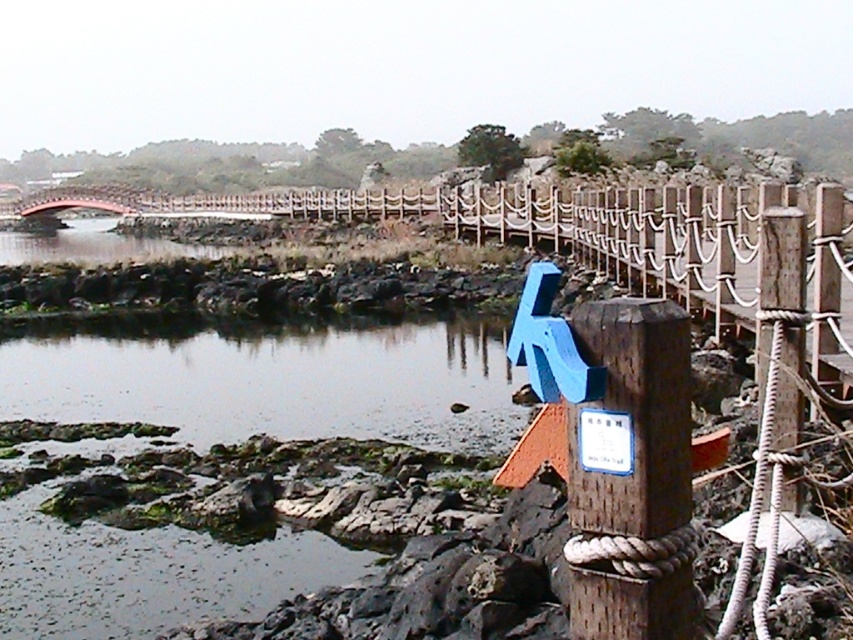
What do you see at coordinates (633, 474) in the screenshot?
I see `brown wooden post at center-right` at bounding box center [633, 474].

Does point (622, 477) come behind point (601, 472)?

No, it is not.

Who is more distant from viewer, (618, 605) or (602, 432)?

The point (618, 605) is behind.

This screenshot has width=853, height=640. In order to click on brown wooden post at center-right in this screenshot , I will do `click(633, 474)`.